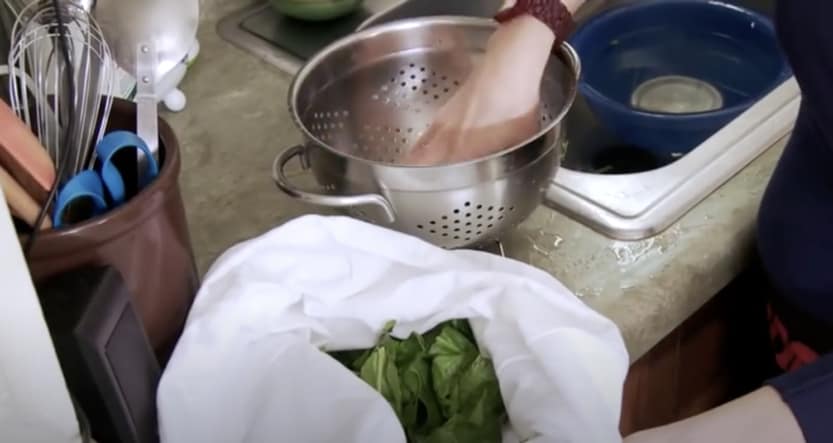
The image size is (833, 443). In order to click on counter top in this screenshot , I will do `click(238, 152)`.